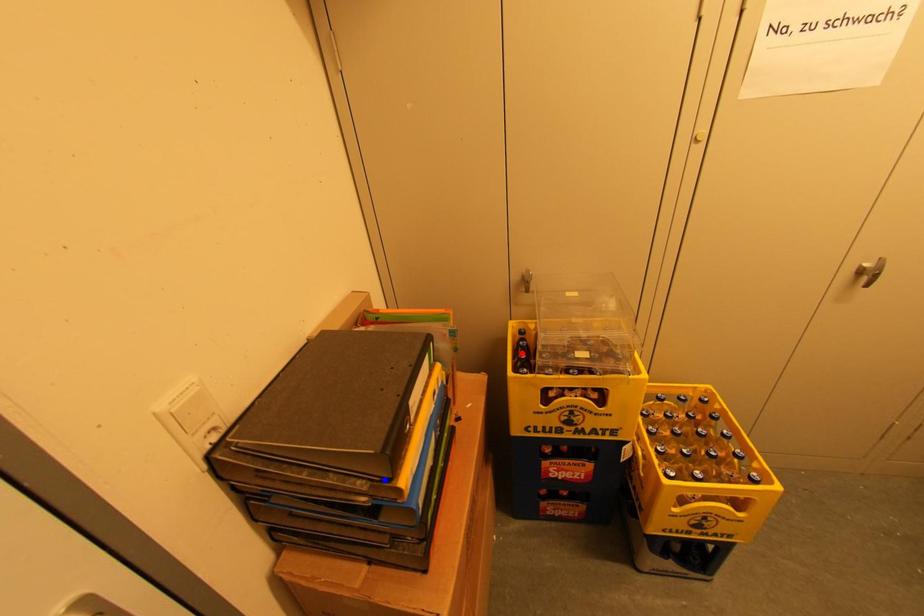
Question: Which of the two points in the image is closer to the camera?

Choices:
 (A) Blue point is closer.
 (B) Red point is closer.

Answer: (A)